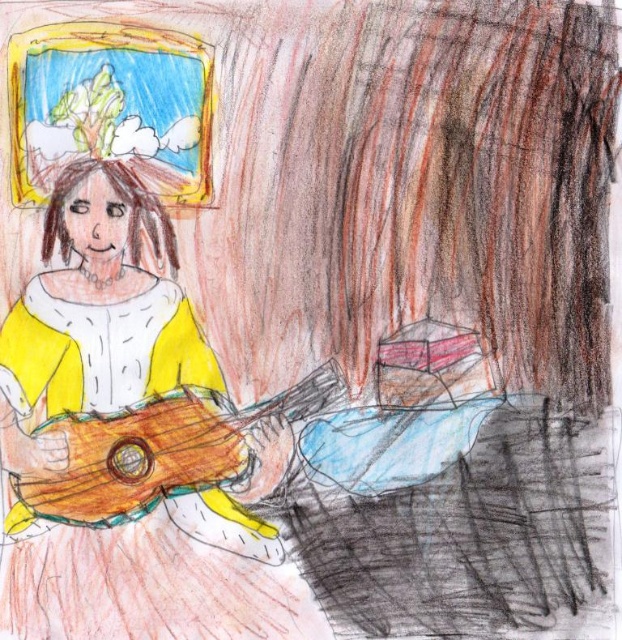
You are an art student analyzing this drawing. You notice a point at coordinates (131,445). What object is located at this point?

The point at coordinates (131,445) is where the matte yellow dress at left is located.